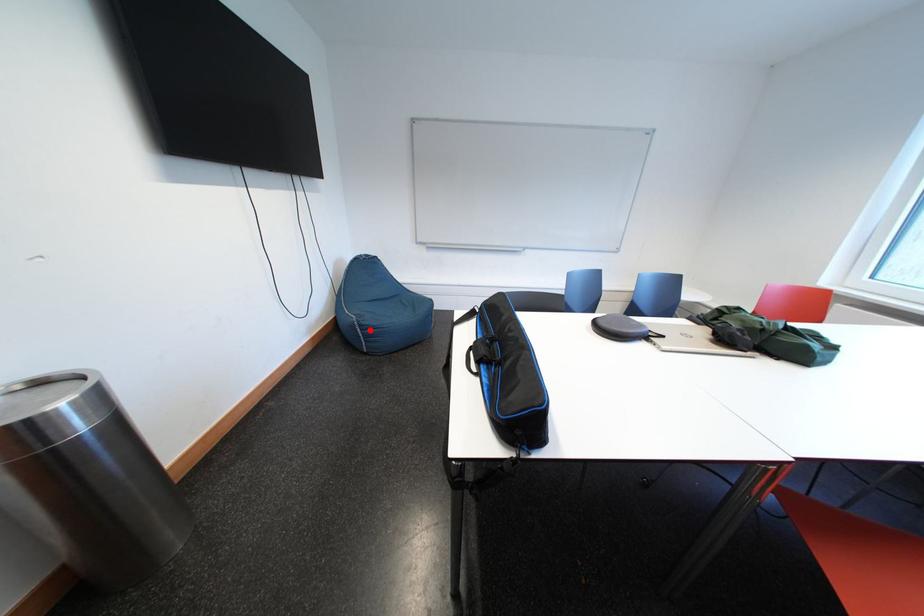
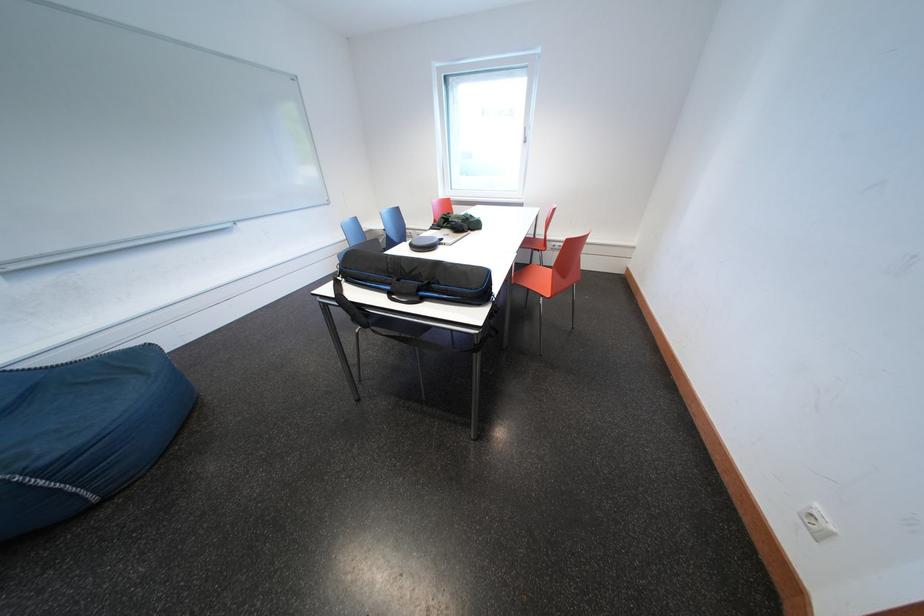
Question: I am providing you with two images of the same scene from different viewpoints. Image1 has a red point marked. In image2, the corresponding 3D location appears at what relative position? Reply with the corresponding letter.

Choices:
 (A) Closer
 (B) Farther

Answer: (B)